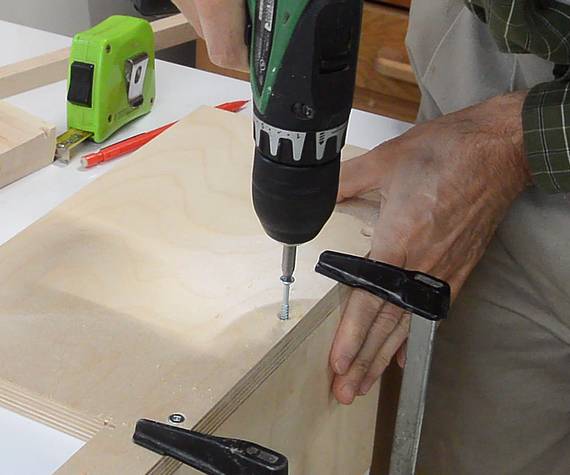
Image resolution: width=570 pixels, height=475 pixels. Find the location of `drawer handle`. drawer handle is located at coordinates (394, 73).